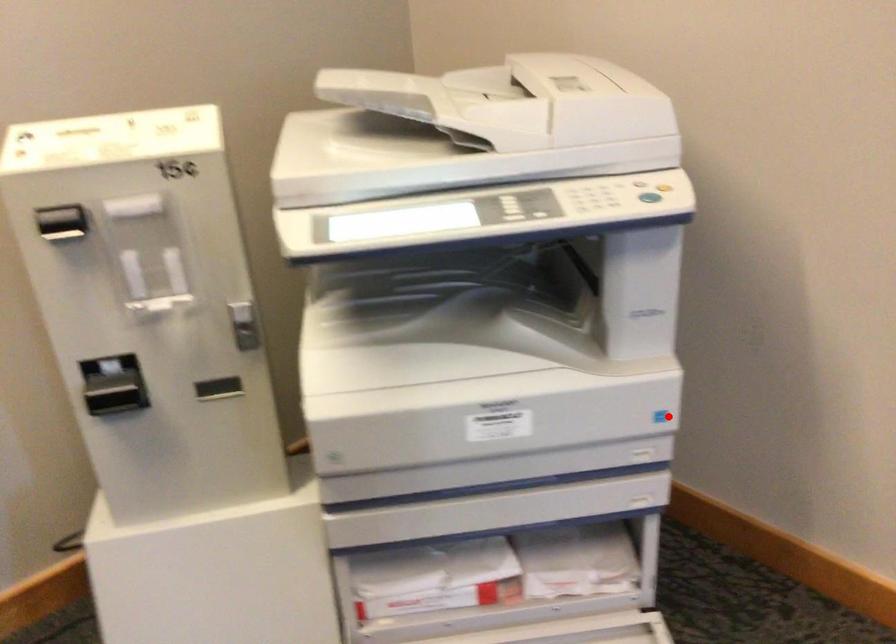
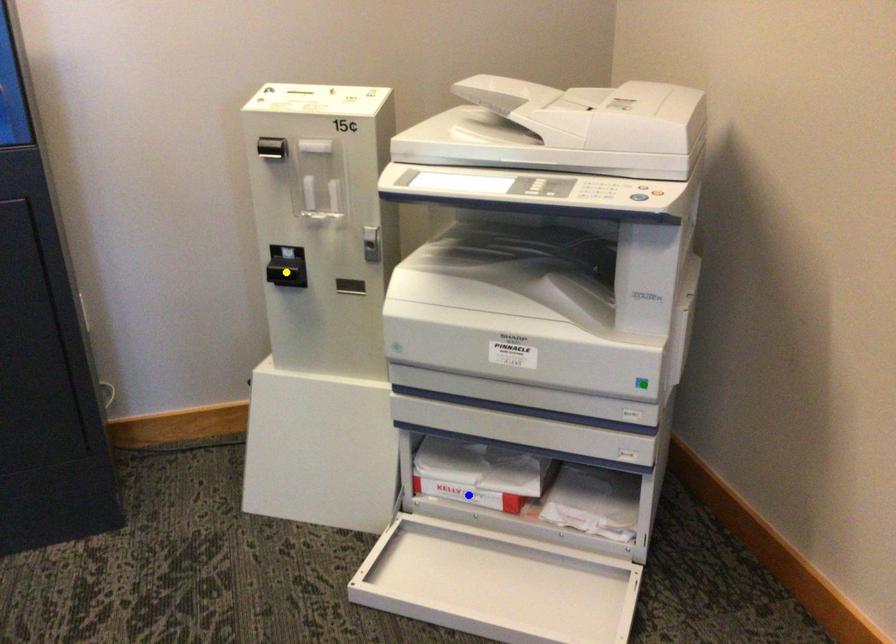
Question: I am providing you with two images of the same scene from different viewpoints. A red point is marked on the first image. You are given multiple points on the second image. Which mark in image 2 goes with the point in image 1?

Choices:
 (A) green point
 (B) yellow point
 (C) blue point

Answer: (A)